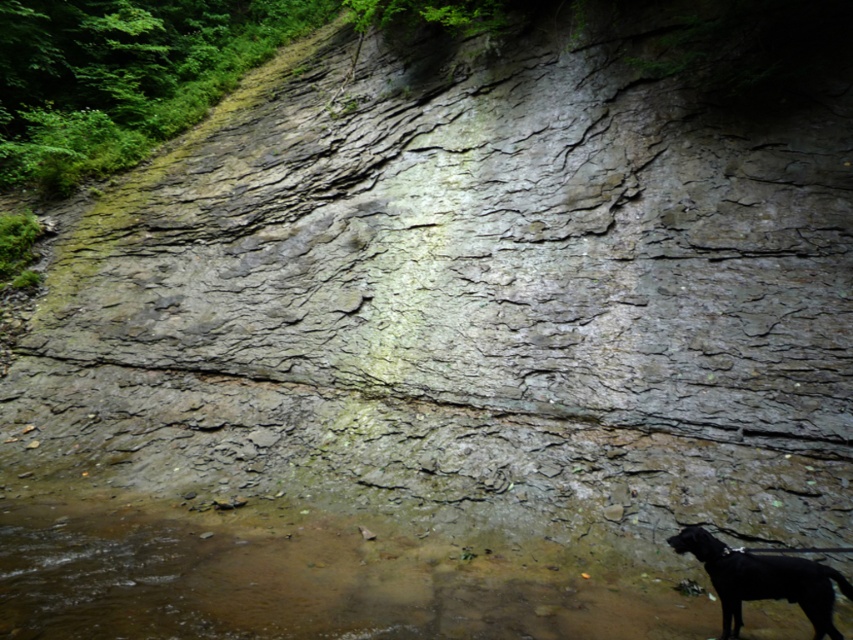
Is brown matte water at lower center below black matte dog at lower right?

Yes.

From the picture: Between brown matte water at lower center and black matte dog at lower right, which one has less height?

brown matte water at lower center is shorter.

This screenshot has width=853, height=640. Identify the location of brown matte water at lower center. (305, 580).

Where is `brown matte water at lower center`? The height and width of the screenshot is (640, 853). brown matte water at lower center is located at coordinates (305, 580).